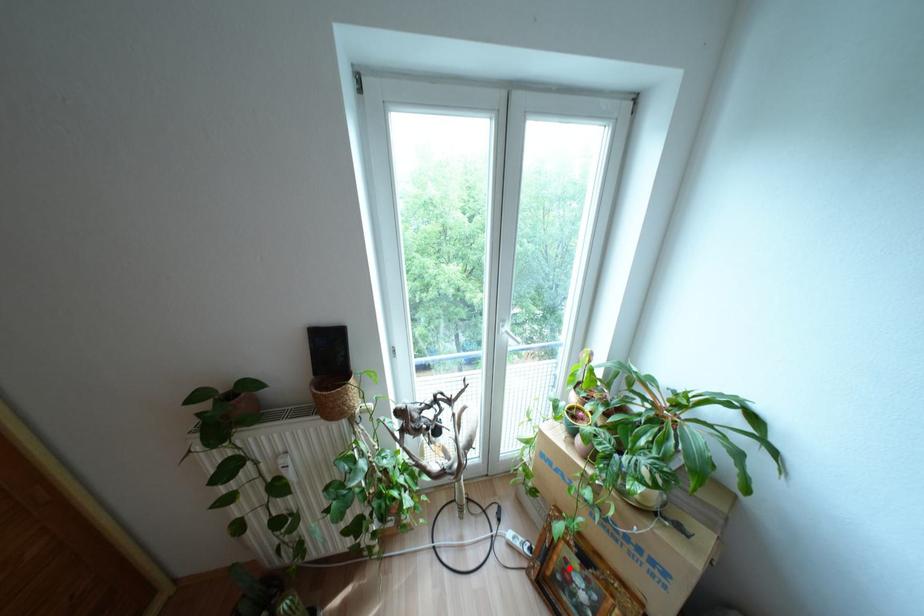
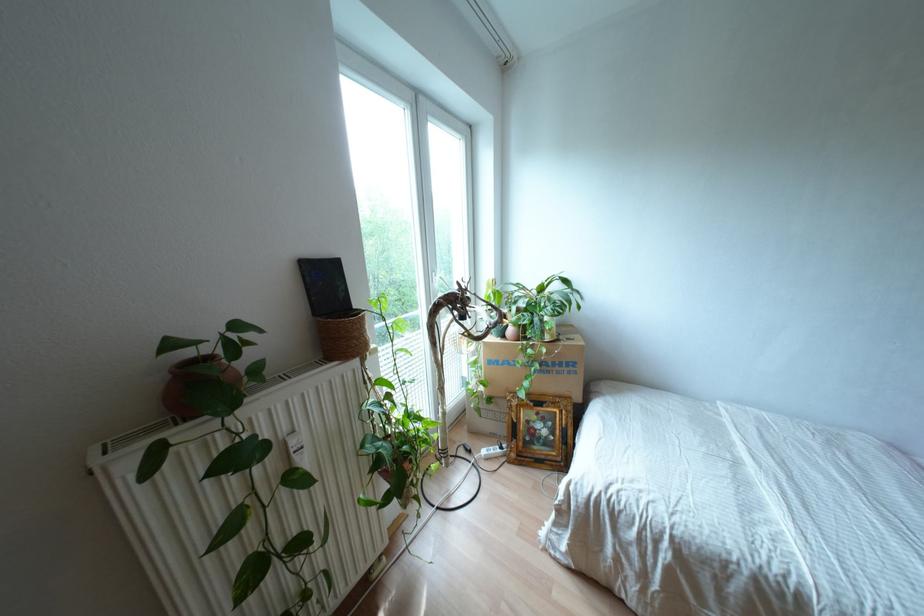
Find the pixel in the second image that matches the highlighted location in the first image.

(530, 424)